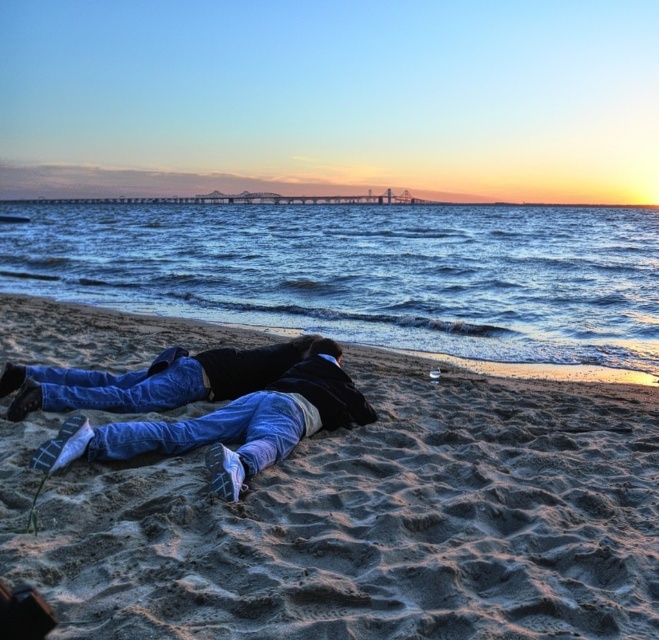
You are a photographer trying to capture the perfect shot of the blue water at center and denim jeans at center. Based on their positions, which one should you focus on first if you want to ensure both are in frame without moving the camera?

The blue water at center is located above denim jeans at center, so you should focus on the denim jeans at center first to ensure both are in frame without moving the camera.

You are a photographer positioned at the origin point of the image. You want to capture a closeup shot of the denim jeans at center. Which direction should you move your camera to focus on them?

The denim jeans at center are located at point 0.664 on the x axis and 0.349 on the y axis. Since the photographer is at the origin, they should move the camera to the right and slightly upwards to focus on the denim jeans at center.

You are a photographer trying to capture the entire scene of the blue water at center and the denim jeans at center in one shot. Based on their sizes, which object will occupy more space in your photo?

The blue water at center is larger in size than the denim jeans at center, so it will occupy more space in the photo.